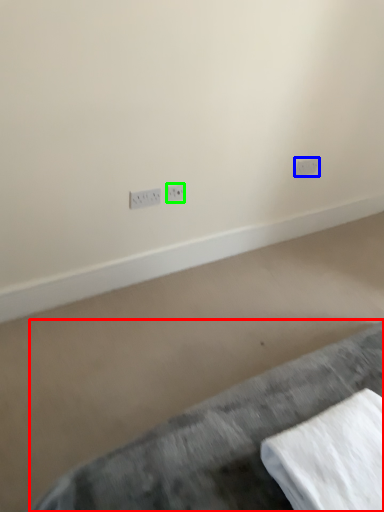
Question: Which is nearer to the furniture (highlighted by a red box)? power plugs and sockets (highlighted by a blue box) or power plugs and sockets (highlighted by a green box).

Choices:
 (A) power plugs and sockets
 (B) power plugs and sockets

Answer: (B)